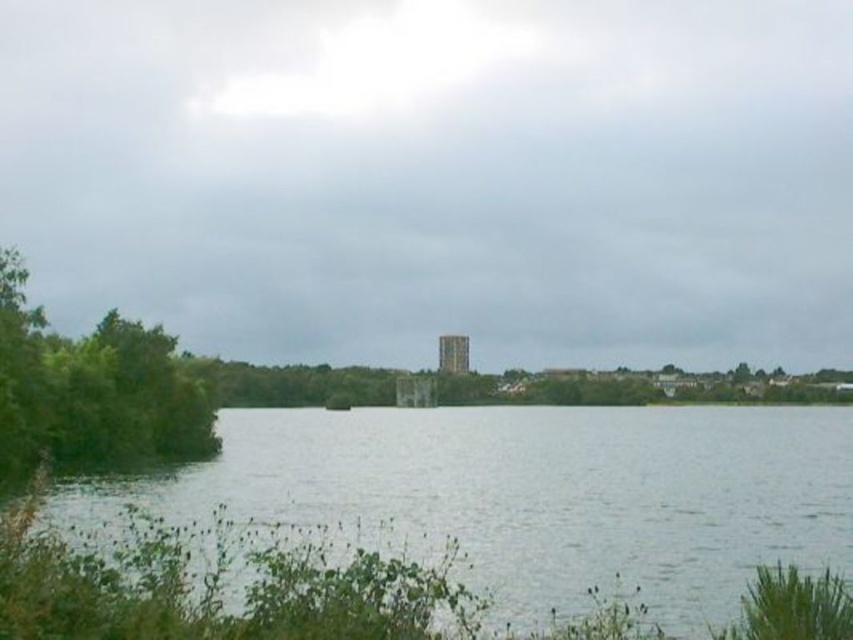
Question: Which of these objects is positioned closest to the green leafy tree at left?

Choices:
 (A) brown stone tower at center
 (B) green water at lower center

Answer: (B)

Question: Among these objects, which one is nearest to the camera?

Choices:
 (A) green leafy tree at left
 (B) brown stone tower at center

Answer: (A)

Question: Does green water at lower center appear under brown stone tower at center?

Choices:
 (A) yes
 (B) no

Answer: (A)

Question: Which point appears closest to the camera in this image?

Choices:
 (A) (151, 365)
 (B) (439, 349)

Answer: (A)

Question: Is green leafy tree at left bigger than brown stone tower at center?

Choices:
 (A) yes
 (B) no

Answer: (A)

Question: Does green water at lower center come in front of brown stone tower at center?

Choices:
 (A) no
 (B) yes

Answer: (B)